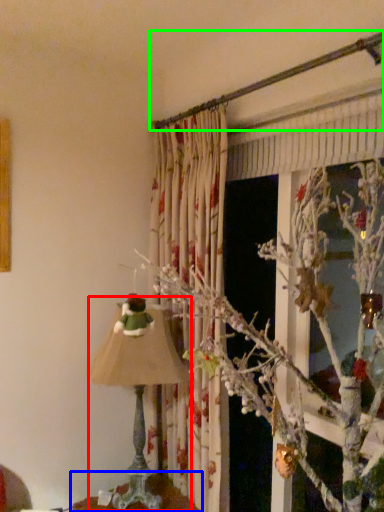
Question: Estimate the real-world distances between objects in this image. Which object is farther from lamp (highlighted by a red box), furniture (highlighted by a blue box) or branch (highlighted by a green box)?

Choices:
 (A) furniture
 (B) branch

Answer: (B)